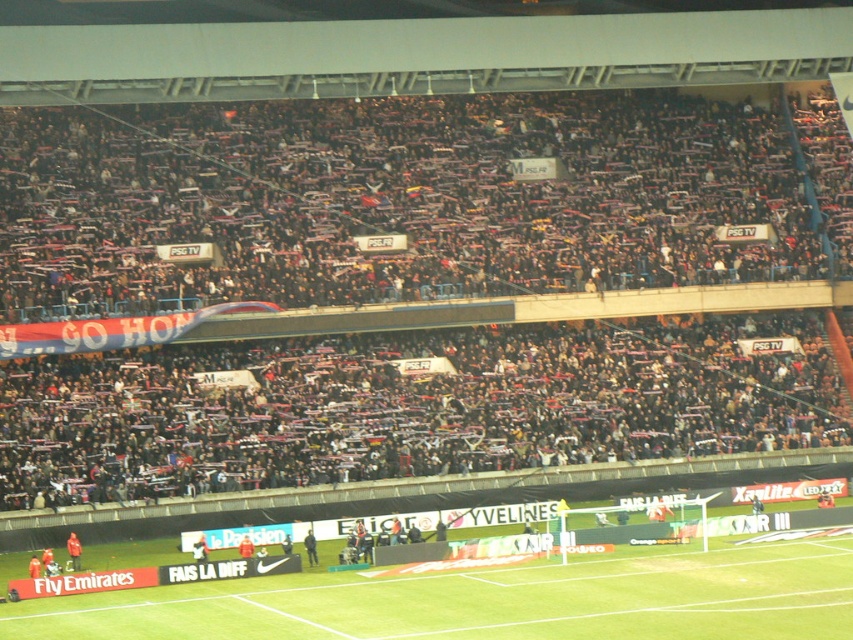
You are a photographer standing at the edge of the field. You want to take a photo of the green grass football field at lower center without any obstructions. However, there is a person wearing a green fabric jacket at lower center in your shot. Can you adjust your angle to capture the field without the jacket?

The green grass football field at lower center is positioned under the green fabric jacket at lower center. By adjusting your camera angle slightly upward, you can capture the field while avoiding the jacket.

You are a photographer at the stadium and want to capture a photo of the orange jersey at center without the green fabric jacket at lower center blocking it. How should you adjust your camera angle?

The green fabric jacket at lower center is above the orange jersey at center, so you can lower your camera angle to avoid the jacket blocking the view of the orange jersey at center.